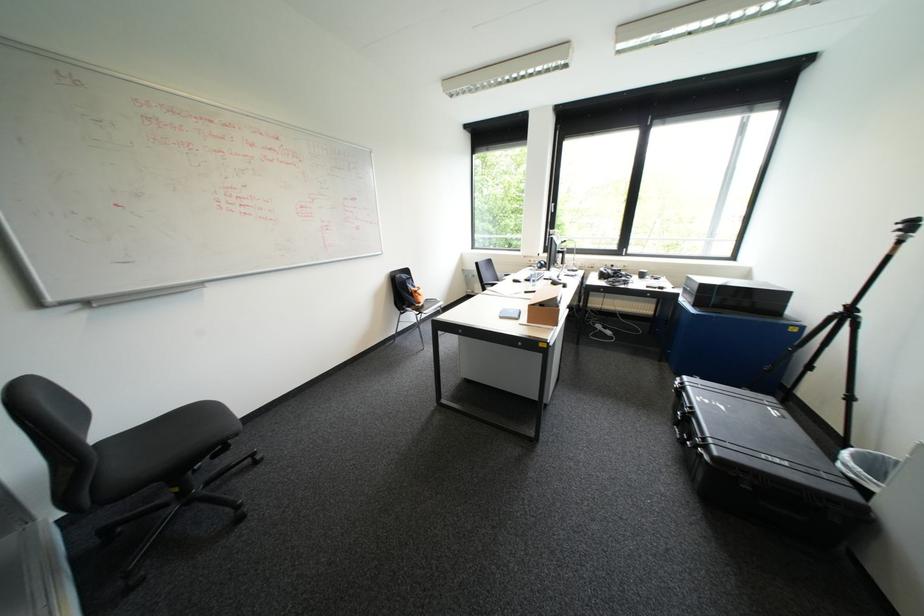
The height and width of the screenshot is (616, 924). What do you see at coordinates (161, 448) in the screenshot?
I see `the black chair sitting surface` at bounding box center [161, 448].